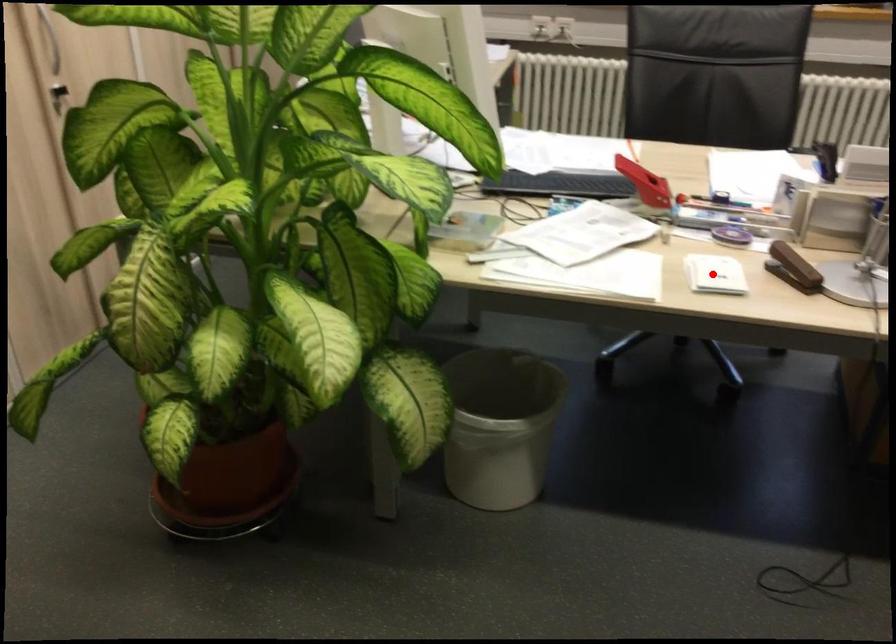
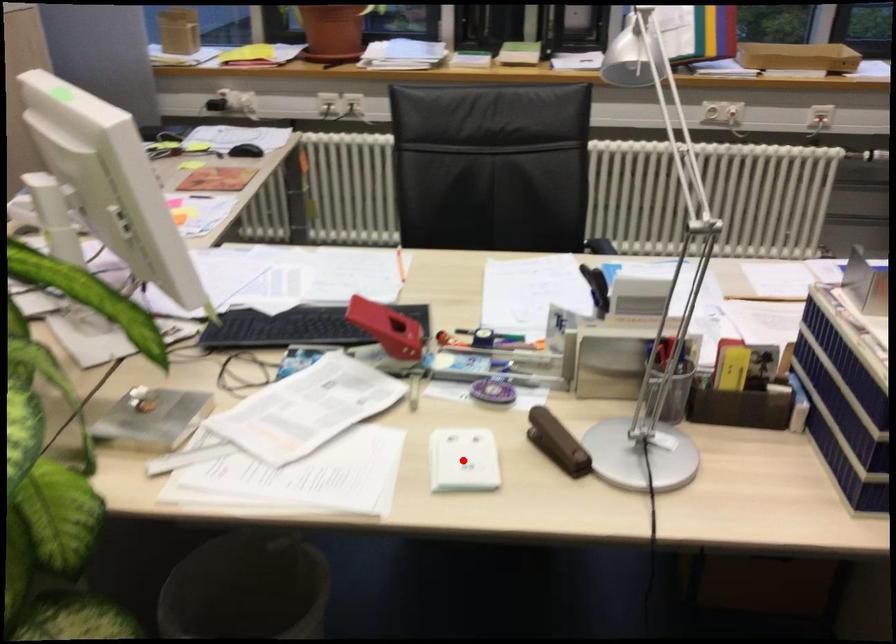
I am providing you with two images of the same scene from different viewpoints. A red point is marked on the first image and another point is marked on the second image. Is the red point in image1 aligned with the point shown in image2?

Yes